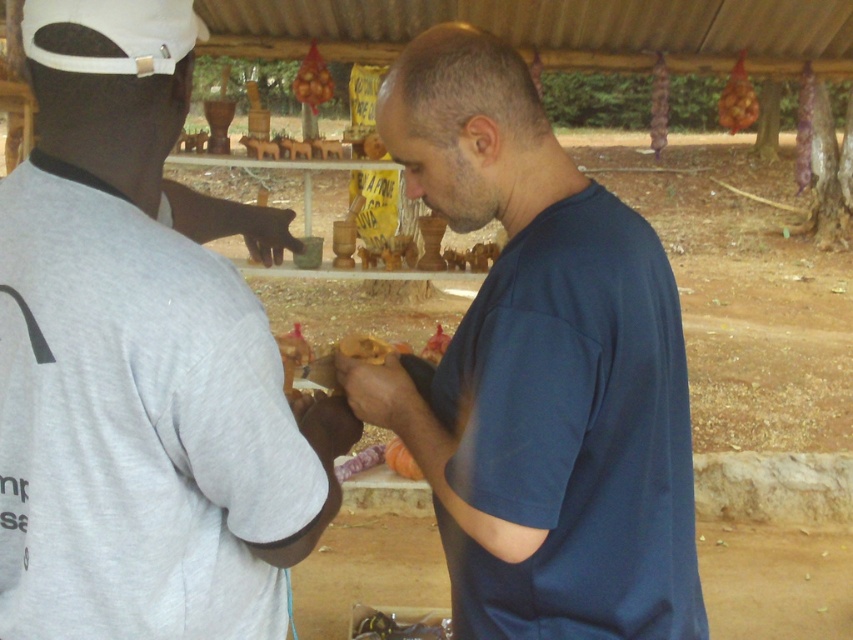
Does gray matte shirt at left appear under blue cotton shirt at center?

No.

Does gray matte shirt at left have a greater height compared to blue cotton shirt at center?

No, gray matte shirt at left is not taller than blue cotton shirt at center.

The image size is (853, 640). What are the coordinates of `gray matte shirt at left` in the screenshot? It's located at coord(137,365).

Is blue cotton shirt at center to the right of smooth orange fruit at center from the viewer's perspective?

Indeed, blue cotton shirt at center is positioned on the right side of smooth orange fruit at center.

Between point (612, 627) and point (399, 474), which one is positioned in front?

Point (612, 627)

Where is `blue cotton shirt at center`? blue cotton shirt at center is located at coordinates (540, 371).

Is point (219, 381) behind point (412, 477)?

No.

Is gray matte shirt at left above smooth orange fruit at center?

Yes.

Where is `gray matte shirt at left`? gray matte shirt at left is located at coordinates (137, 365).